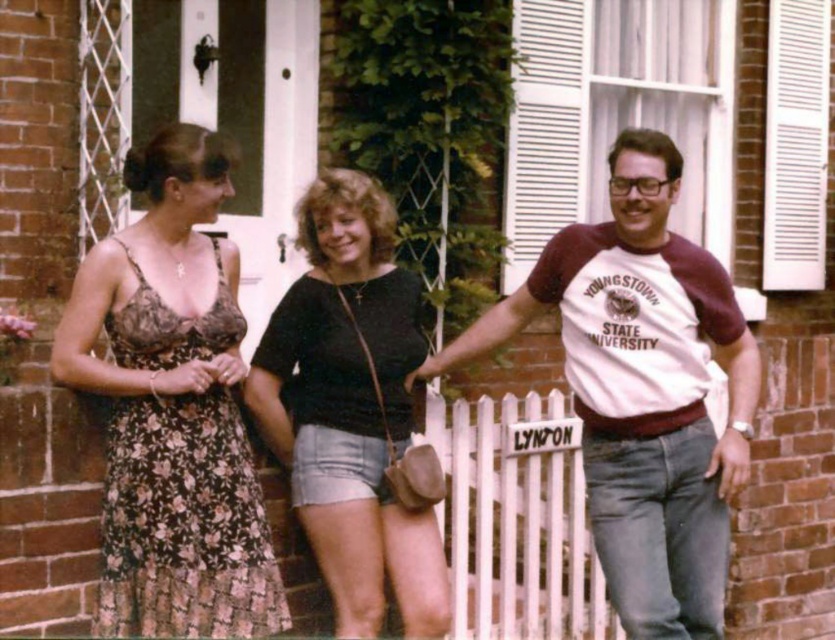
You are standing in front of the brick house with the white picket fence. There are three people here. The person in the floral dress at left is represented by the point with coordinates (x=439, y=372). If you want to greet them, which direction should you face relative to the point?

The floral dress at left is represented by point (x=439, y=372). To greet them, you should face towards the left side of the image where the floral dress at left is located.